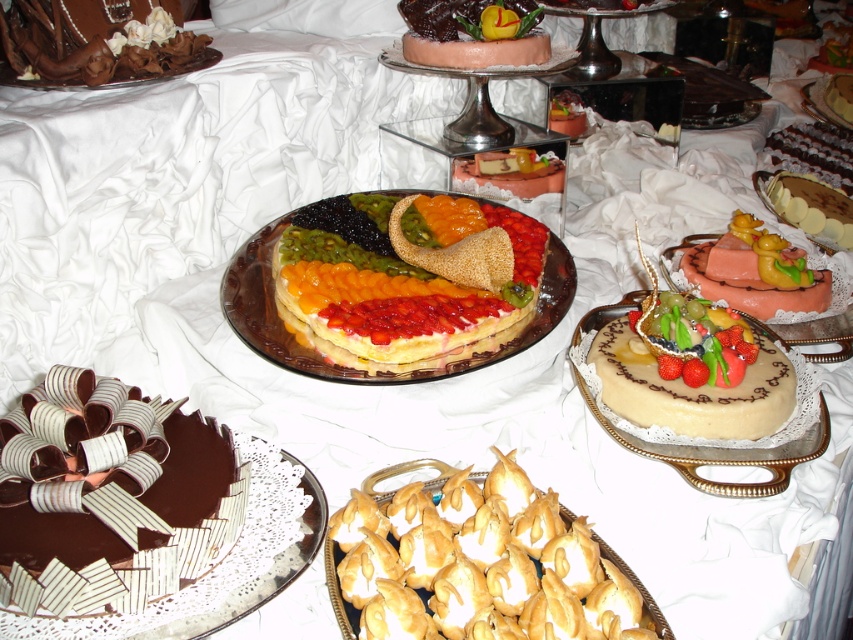
In the scene shown: Which of these two, chocolatesmoothcake at left or smooth chocolate cake at center, stands taller?

With more height is smooth chocolate cake at center.

Is the position of chocolatesmoothcake at left less distant than that of smooth chocolate cake at center?

Yes, it is.

Does point (134, 16) lie in front of point (831, 93)?

Yes, it is.

Where is `chocolatesmoothcake at left`? chocolatesmoothcake at left is located at coordinates (97, 42).

Can you confirm if multicolored fruit tart at center is thinner than pink frosted cake at center?

Incorrect, multicolored fruit tart at center's width is not less than pink frosted cake at center's.

Does multicolored fruit tart at center appear on the left side of pink frosted cake at center?

Yes, multicolored fruit tart at center is to the left of pink frosted cake at center.

Which is behind, point (262, 252) or point (509, 161)?

Positioned behind is point (509, 161).

Where is `multicolored fruit tart at center`? multicolored fruit tart at center is located at coordinates (372, 362).

Which is behind, point (755, 248) or point (469, 232)?

Point (755, 248)

Does point (767, 275) lie in front of point (428, 212)?

Yes, point (767, 275) is in front of point (428, 212).

Where is `smooth pink cake with fruit at center`? smooth pink cake with fruit at center is located at coordinates (755, 272).